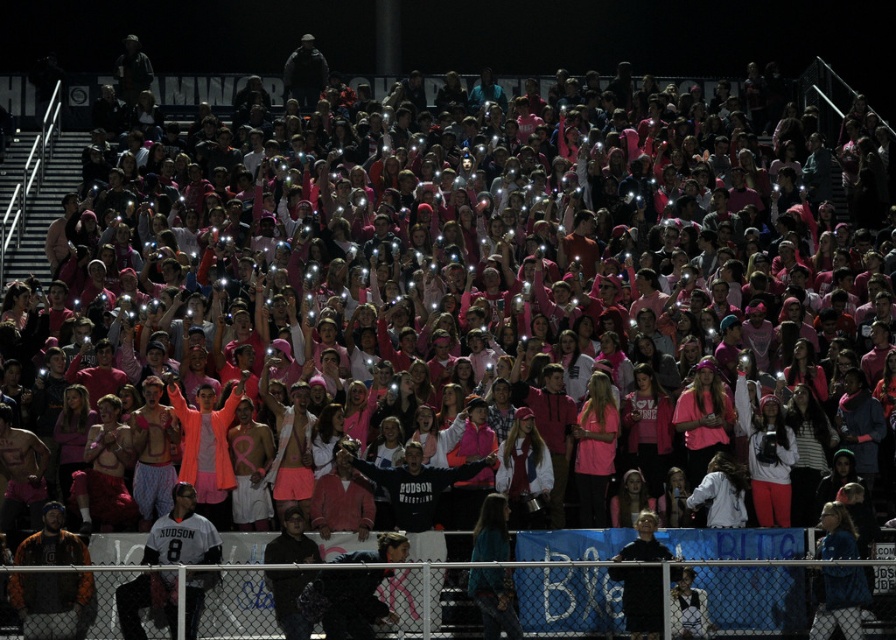
Who is lower down, orange leather jacket at lower left or black matte jacket at lower center?

orange leather jacket at lower left is below.

Locate an element on the screen. The height and width of the screenshot is (640, 896). orange leather jacket at lower left is located at coordinates (52, 604).

Where is `white jersey at lower left`? This screenshot has width=896, height=640. white jersey at lower left is located at coordinates (182, 532).

Does white jersey at lower left have a smaller size compared to orange leather jacket at lower left?

Indeed, white jersey at lower left has a smaller size compared to orange leather jacket at lower left.

Who is more forward, [138,577] or [63,573]?

Positioned in front is point [63,573].

This screenshot has height=640, width=896. Find the location of `white jersey at lower left`. white jersey at lower left is located at coordinates (182, 532).

Where is `white jersey at lower left`? The height and width of the screenshot is (640, 896). white jersey at lower left is located at coordinates (182, 532).

Is point (194, 600) behind point (616, 560)?

That is False.

At what (x,y) coordinates should I click in order to perform the action: click on white jersey at lower left. Please return your answer as a coordinate pair (x, y). Image resolution: width=896 pixels, height=640 pixels. Looking at the image, I should click on (182, 532).

I want to click on white jersey at lower left, so click(182, 532).